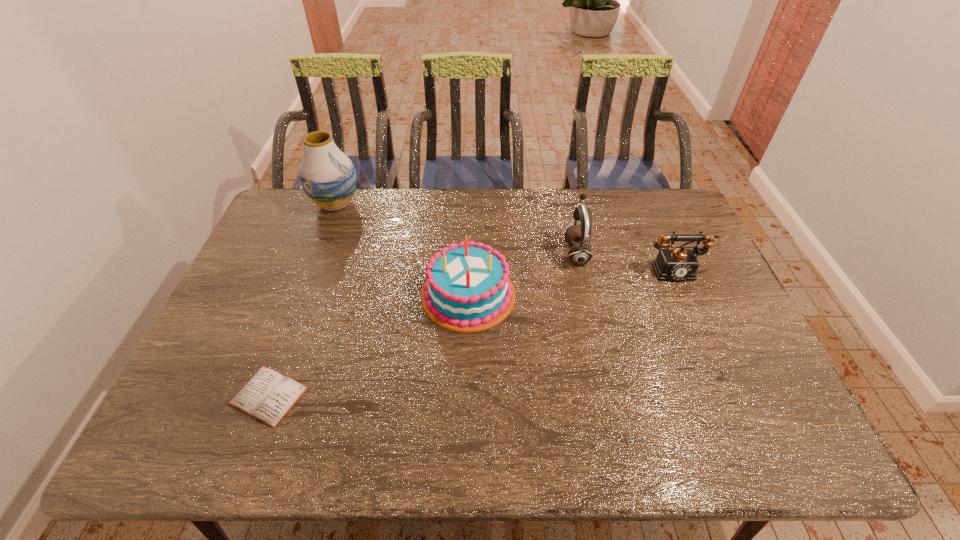
At what (x,y) coordinates should I click in order to perform the action: click on vacant space located on the ear pads of the earphone. Please return your answer as a coordinate pair (x, y). Looking at the image, I should click on (539, 253).

Where is `vacant space located on the left of the birthday cake`? vacant space located on the left of the birthday cake is located at coordinates (286, 295).

Find the location of a particular element. free location located on the front of the rightmost object at the rotary dial is located at coordinates (721, 377).

Identify the location of vacant position located on the right of the shortest object. The height and width of the screenshot is (540, 960). (456, 396).

Image resolution: width=960 pixels, height=540 pixels. I want to click on object at the far edge, so click(328, 177).

Where is `object that is at the near edge`? object that is at the near edge is located at coordinates (268, 396).

Where is `vase that is at the left edge`? Image resolution: width=960 pixels, height=540 pixels. vase that is at the left edge is located at coordinates (328, 177).

In order to click on diary located in the left edge section of the desktop in this screenshot , I will do `click(268, 396)`.

Identify the location of object that is at the right edge. The height and width of the screenshot is (540, 960). (679, 264).

Find the location of a particular element. The height and width of the screenshot is (540, 960). object at the far left corner is located at coordinates (328, 177).